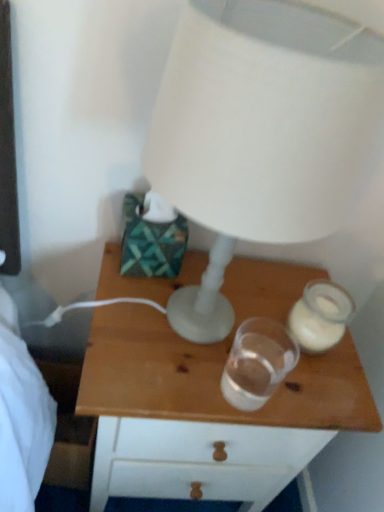
Locate an element on the screen. free space above wooden nightstand at center (from a real-world perspective) is located at coordinates (215, 332).